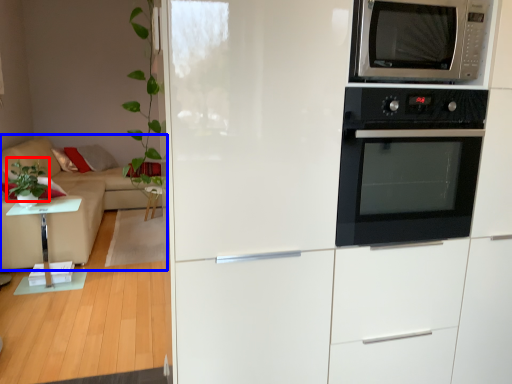
Question: Among these objects, which one is farthest to the camera, plant (highlighted by a red box) or studio couch (highlighted by a blue box)?

Choices:
 (A) plant
 (B) studio couch

Answer: (B)